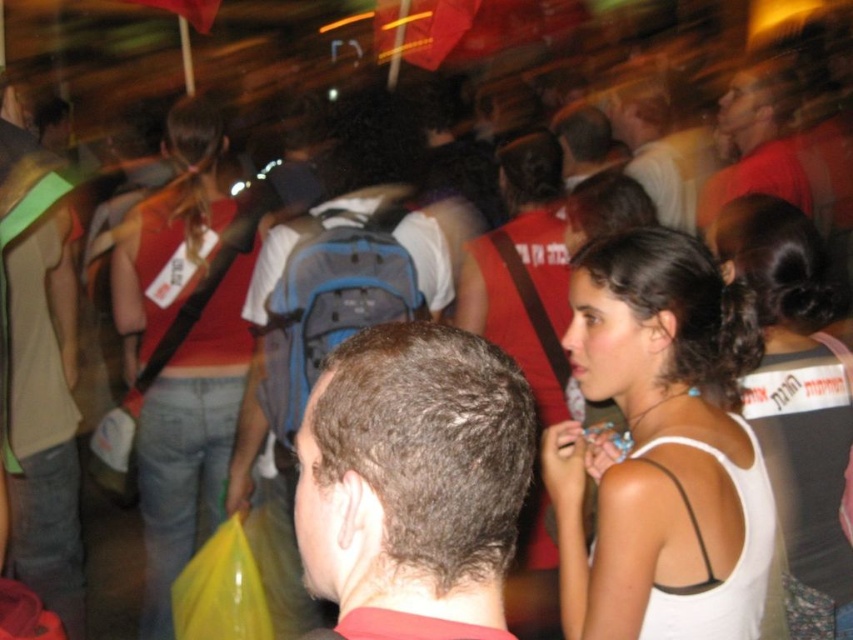
Question: Which of these objects is positioned closest to the blue fabric backpack at center?

Choices:
 (A) white matte tank top at center
 (B) matte red shirt at upper right

Answer: (A)

Question: Where is white matte tank top at center located in relation to matte red tank top at left in the image?

Choices:
 (A) right
 (B) left

Answer: (A)

Question: Can you confirm if dark brown hair at center is positioned below matte gray backpack at center?

Choices:
 (A) no
 (B) yes

Answer: (B)

Question: Based on their relative distances, which object is farther from the smooth brown leather jacket at upper center?

Choices:
 (A) matte red tank top at left
 (B) dark brown hair at center
 (C) white fabric tank top at center

Answer: (B)

Question: Which of the following is the closest to the observer?

Choices:
 (A) white fabric tank top at center
 (B) blue fabric backpack at center

Answer: (A)

Question: Observing the image, what is the correct spatial positioning of white matte tank top at center in reference to matte gray backpack at center?

Choices:
 (A) right
 (B) left

Answer: (B)